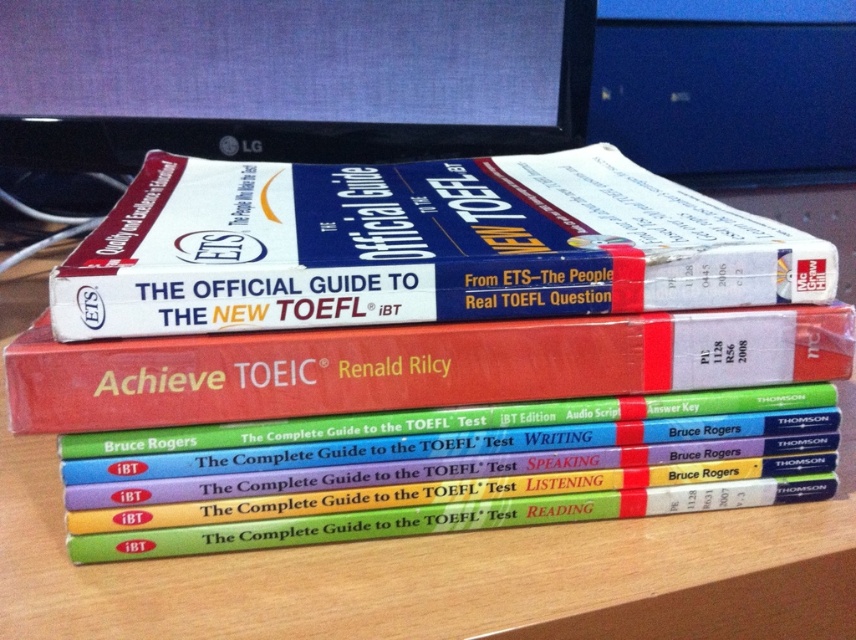
Question: Where is white paper at upper center located in relation to black glossy monitor at upper center in the image?

Choices:
 (A) above
 (B) below

Answer: (B)

Question: Does black glossy monitor at upper center come behind red matte hardcover book at center?

Choices:
 (A) no
 (B) yes

Answer: (B)

Question: Which of the following is the farthest from the observer?

Choices:
 (A) black glossy monitor at upper center
 (B) white paper at upper center

Answer: (A)

Question: Which of these objects is positioned farthest from the white paper at upper center?

Choices:
 (A) black glossy monitor at upper center
 (B) red matte hardcover book at center

Answer: (A)

Question: Which object appears farthest from the camera in this image?

Choices:
 (A) white paper at upper center
 (B) black glossy monitor at upper center
 (C) red matte hardcover book at center

Answer: (B)

Question: Is black glossy monitor at upper center positioned before red matte hardcover book at center?

Choices:
 (A) yes
 (B) no

Answer: (B)